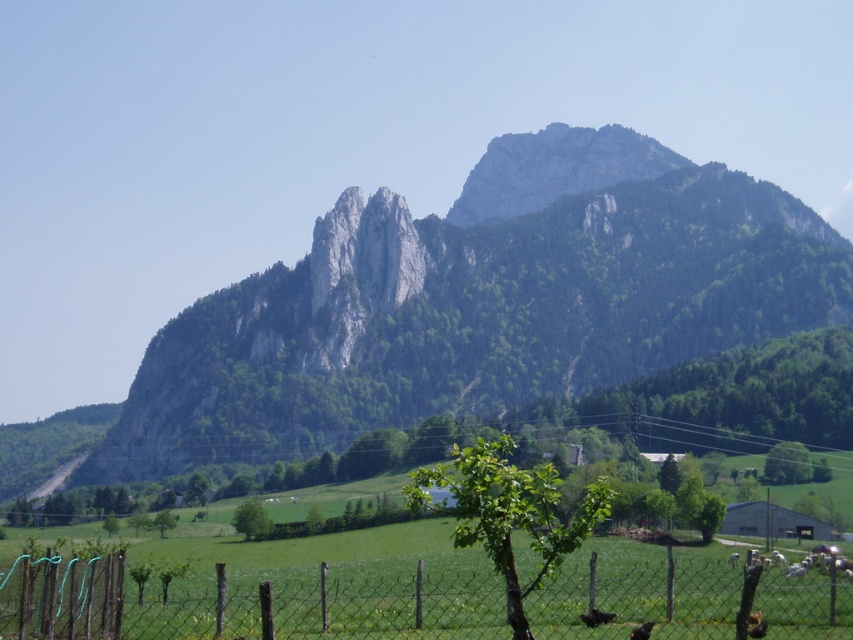
You are a landscape photographer planning to capture the green rocky mountain at center in your shot. However, you notice the wire mesh fence at lower center might obstruct the view. Based on their sizes, which object would dominate the frame if you position your camera to include both?

The green rocky mountain at center would dominate the frame because it has a larger size compared to the wire mesh fence at lower center.

Looking at this image, you are standing in the rural landscape and want to take a photo of the green rocky mountain at center and the wire mesh fence at lower center. If you want the mountain to appear to the left of the fence in your photo, should you position yourself to the right or left of the fence?

The green rocky mountain at center is already positioned on the left side of the wire mesh fence at lower center. To have the mountain appear to the left of the fence in your photo, you should position yourself to the right of the fence so that the fence is to your left relative to the mountain.

You are a landscape photographer planning to capture the entire view of the green rocky mountain at center and the wire mesh fence at lower center in one shot. Based on their widths, which object will require you to adjust your camera angle more to ensure both are fully visible?

The green rocky mountain at center has a greater width than the wire mesh fence at lower center, so you will need to adjust your camera angle more to include the entire width of the green rocky mountain at center in the shot.